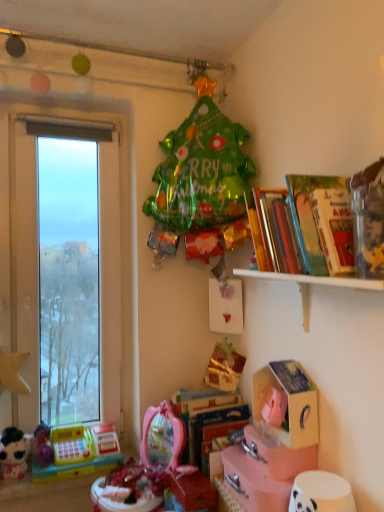
The width and height of the screenshot is (384, 512). In order to click on white wooden shelf at upper right in this screenshot , I will do pyautogui.click(x=312, y=284).

This screenshot has width=384, height=512. What do you see at coordinates (161, 466) in the screenshot?
I see `shiny pink mirror at lower center, the 4th toy viewed from the left` at bounding box center [161, 466].

Describe the element at coordinates (264, 470) in the screenshot. I see `pink cardboard box at lower center, the second cardboard box from the top` at that location.

Where is `plush white cat at lower left, acting as the 4th toy starting from the right`? plush white cat at lower left, acting as the 4th toy starting from the right is located at coordinates (14, 453).

From a real-world perspective, between hardcover book at center, the 2th book in the front-to-back sequence, and matte pink cardboard box at lower center, which appears as the first cardboard box when viewed from the top, who is vertically higher?

In real-world perspective, matte pink cardboard box at lower center, which appears as the first cardboard box when viewed from the top, is above.

From the image's perspective, which object appears higher, hardcover book at center, the 2th book in the front-to-back sequence, or matte pink cardboard box at lower center, which appears as the first cardboard box when viewed from the top?

matte pink cardboard box at lower center, which appears as the first cardboard box when viewed from the top, is shown above in the image.

Considering the points (199, 432) and (293, 446), which point is behind, point (199, 432) or point (293, 446)?

Positioned behind is point (199, 432).

Looking at this image, could you tell me if hardcover book at center, the 2th book in the front-to-back sequence, is turned towards matte pink cardboard box at lower center, which appears as the first cardboard box when viewed from the top?

No.

Considering the points (255, 413) and (16, 434), which point is in front, point (255, 413) or point (16, 434)?

Positioned in front is point (255, 413).

Consider the image. Considering the sizes of matte pink cardboard box at lower center, which is the 2th cardboard box in bottom-to-top order, and plush white cat at lower left, acting as the 4th toy starting from the right, in the image, is matte pink cardboard box at lower center, which is the 2th cardboard box in bottom-to-top order, wider or thinner than plush white cat at lower left, acting as the 4th toy starting from the right,?

Considering their sizes, matte pink cardboard box at lower center, which is the 2th cardboard box in bottom-to-top order, looks broader than plush white cat at lower left, acting as the 4th toy starting from the right.

Considering the relative sizes of matte pink cardboard box at lower center, which appears as the first cardboard box when viewed from the top, and plush white cat at lower left, acting as the 4th toy starting from the right, in the image provided, is matte pink cardboard box at lower center, which appears as the first cardboard box when viewed from the top, taller than plush white cat at lower left, acting as the 4th toy starting from the right,?

Indeed, matte pink cardboard box at lower center, which appears as the first cardboard box when viewed from the top, has a greater height compared to plush white cat at lower left, acting as the 4th toy starting from the right.

Does matte pink cardboard box at lower center, which is the 2th cardboard box in bottom-to-top order, come in front of plush white cat at lower left, acting as the first toy starting from the left?

Yes, matte pink cardboard box at lower center, which is the 2th cardboard box in bottom-to-top order, is closer to the camera.

From a real-world perspective, count 2nd books upward from the shiny pink toy at center, which appears as the 2th toy when viewed from the right, and point to it. Please provide its 2D coordinates.

[(293, 225)]

Is point (280, 226) positioned in front of point (91, 495)?

Yes.

From the image's perspective, which object appears higher, hardcover book at upper right, arranged as the 1th book when viewed from the front, or shiny pink toy at center, positioned as the third toy in left-to-right order?

hardcover book at upper right, arranged as the 1th book when viewed from the front, is shown above in the image.

Considering the sizes of objects hardcover book at upper right, the first book viewed from the top, and shiny pink toy at center, which appears as the 2th toy when viewed from the right, in the image provided, who is shorter, hardcover book at upper right, the first book viewed from the top, or shiny pink toy at center, which appears as the 2th toy when viewed from the right,?

With less height is shiny pink toy at center, which appears as the 2th toy when viewed from the right.

Considering the positions of objects yellow plastic cash register at lower left, which appears as the 2th toy when viewed from the left, and white wooden shelf at upper right in the image provided, who is more to the right, yellow plastic cash register at lower left, which appears as the 2th toy when viewed from the left, or white wooden shelf at upper right?

From the viewer's perspective, white wooden shelf at upper right appears more on the right side.

Considering the sizes of objects yellow plastic cash register at lower left, which appears as the 2th toy when viewed from the left, and white wooden shelf at upper right in the image provided, who is smaller, yellow plastic cash register at lower left, which appears as the 2th toy when viewed from the left, or white wooden shelf at upper right?

Smaller between the two is yellow plastic cash register at lower left, which appears as the 2th toy when viewed from the left.

At what (x,y) coordinates should I click in order to perform the action: click on shelf that appears on the right of yellow plastic cash register at lower left, the 3th toy viewed from the right. Please return your answer as a coordinate pair (x, y). Image resolution: width=384 pixels, height=512 pixels. Looking at the image, I should click on (312, 284).

Is yellow plastic cash register at lower left, which appears as the 2th toy when viewed from the left, oriented towards white wooden shelf at upper right?

No, yellow plastic cash register at lower left, which appears as the 2th toy when viewed from the left, is not turned towards white wooden shelf at upper right.

From a real-world perspective, is hardcover book at center, the 1th book in the back-to-front sequence, located higher than plush white cat at lower left, acting as the first toy starting from the left?

Yes, from a real-world perspective, hardcover book at center, the 1th book in the back-to-front sequence, is on top of plush white cat at lower left, acting as the first toy starting from the left.

Considering the sizes of objects hardcover book at center, the 1th book in the back-to-front sequence, and plush white cat at lower left, acting as the 4th toy starting from the right, in the image provided, who is bigger, hardcover book at center, the 1th book in the back-to-front sequence, or plush white cat at lower left, acting as the 4th toy starting from the right,?

With larger size is hardcover book at center, the 1th book in the back-to-front sequence.

Is point (245, 419) closer or farther from the camera than point (23, 469)?

Clearly, point (245, 419) is closer to the camera than point (23, 469).

Could you measure the distance between hardcover book at center, the 2th book in the front-to-back sequence, and plush white cat at lower left, acting as the 4th toy starting from the right?

A distance of 27.34 inches exists between hardcover book at center, the 2th book in the front-to-back sequence, and plush white cat at lower left, acting as the 4th toy starting from the right.

Which is correct: matte pink cardboard box at lower center, which is the 2th cardboard box in bottom-to-top order, is inside yellow plastic cash register at lower left, the 3th toy viewed from the right, or outside of it?

matte pink cardboard box at lower center, which is the 2th cardboard box in bottom-to-top order, exists outside the volume of yellow plastic cash register at lower left, the 3th toy viewed from the right.

The width and height of the screenshot is (384, 512). In order to click on the 1st cardboard box in front of the yellow plastic cash register at lower left, which appears as the 2th toy when viewed from the left in this screenshot , I will do `click(289, 401)`.

Which is in front, point (258, 392) or point (113, 462)?

The point (258, 392) is in front.

Is yellow plastic cash register at lower left, which appears as the 2th toy when viewed from the left, far away from hardcover book at center, the 1th book in the back-to-front sequence?

No.

Is hardcover book at center, placed as the first book when sorted from bottom to top, at the back of yellow plastic cash register at lower left, the 3th toy viewed from the right?

That's not correct — yellow plastic cash register at lower left, the 3th toy viewed from the right, is not looking away from hardcover book at center, placed as the first book when sorted from bottom to top.

Which is closer, (88, 439) or (236, 426)?

Point (88, 439) appears to be farther away from the viewer than point (236, 426).

Would you say yellow plastic cash register at lower left, the 3th toy viewed from the right, is to the left or to the right of hardcover book at center, which is counted as the 2th book, starting from the top, in the picture?

Clearly, yellow plastic cash register at lower left, the 3th toy viewed from the right, is on the left of hardcover book at center, which is counted as the 2th book, starting from the top, in the image.

Which cardboard box is the 2nd one when counting from the right side of the hardcover book at center, placed as the first book when sorted from bottom to top? Please provide its 2D coordinates.

[(289, 401)]

At what (x,y) coordinates should I click in order to perform the action: click on the 1st cardboard box in front of the plush white cat at lower left, acting as the first toy starting from the left, counting from the anchor's position. Please return your answer as a coordinate pair (x, y). The width and height of the screenshot is (384, 512). Looking at the image, I should click on [289, 401].

From the image, which object appears to be nearer to hardcover book at center, placed as the first book when sorted from bottom to top, pink cardboard box at lower center, the second cardboard box from the top, or shiny pink mirror at lower center, which ranks as the first toy in right-to-left order?

Based on the image, shiny pink mirror at lower center, which ranks as the first toy in right-to-left order, appears to be nearer to hardcover book at center, placed as the first book when sorted from bottom to top.

In the scene shown: Based on their spatial positions, is matte pink cardboard box at lower center, which is the 2th cardboard box in bottom-to-top order, or yellow plastic cash register at lower left, which appears as the 2th toy when viewed from the left, further from transparent glass window at left?

Among the two, matte pink cardboard box at lower center, which is the 2th cardboard box in bottom-to-top order, is located further to transparent glass window at left.

Looking at the image, which one is located further to matte pink cardboard box at lower center, which is the 2th cardboard box in bottom-to-top order, shiny pink toy at center, positioned as the third toy in left-to-right order, or plush white cat at lower left, acting as the first toy starting from the left?

plush white cat at lower left, acting as the first toy starting from the left, is positioned further to the anchor matte pink cardboard box at lower center, which is the 2th cardboard box in bottom-to-top order.

Based on their spatial positions, is matte pink cardboard box at lower center, which appears as the first cardboard box when viewed from the top, or yellow plastic cash register at lower left, which appears as the 2th toy when viewed from the left, further from white wooden shelf at upper right?

yellow plastic cash register at lower left, which appears as the 2th toy when viewed from the left, is further to white wooden shelf at upper right.

From the image, which object appears to be farther from hardcover book at center, the 1th book in the back-to-front sequence, shiny pink toy at center, which appears as the 2th toy when viewed from the right, or transparent glass window at left?

transparent glass window at left.

Which object lies nearer to the anchor point white wooden shelf at upper right, shiny pink toy at center, which appears as the 2th toy when viewed from the right, or matte pink cardboard box at lower center, which appears as the first cardboard box when viewed from the top?

The object closer to white wooden shelf at upper right is matte pink cardboard box at lower center, which appears as the first cardboard box when viewed from the top.

Considering their positions, is shiny pink mirror at lower center, the 4th toy viewed from the left, positioned further to transparent glass window at left than matte pink cardboard box at lower center, which is the 2th cardboard box in bottom-to-top order?

The object further to transparent glass window at left is matte pink cardboard box at lower center, which is the 2th cardboard box in bottom-to-top order.

Estimate the real-world distances between objects in this image. Which object is further from white wooden shelf at upper right, shiny pink mirror at lower center, the 4th toy viewed from the left, or plush white cat at lower left, acting as the first toy starting from the left?

plush white cat at lower left, acting as the first toy starting from the left, is further to white wooden shelf at upper right.

Locate an element on the screen. The height and width of the screenshot is (512, 384). book between transparent glass window at left and shiny pink mirror at lower center, which ranks as the first toy in right-to-left order, in the vertical direction is located at coordinates (207, 421).

In order to click on shelf between hardcover book at upper right, arranged as the 1th book when viewed from the front, and shiny pink toy at center, which appears as the 2th toy when viewed from the right, from top to bottom in this screenshot , I will do tap(312, 284).

Locate an element on the screen. cardboard box between transparent glass window at left and matte pink cardboard box at lower center, which appears as the first cardboard box when viewed from the top is located at coordinates (264, 470).

Locate an element on the screen. window located between plush white cat at lower left, acting as the first toy starting from the left, and hardcover book at center, which is counted as the 2th book, starting from the top, in the left-right direction is located at coordinates (37, 259).